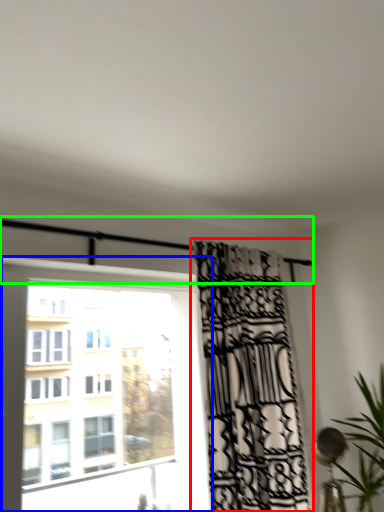
Question: Based on their relative distances, which object is farther from curtain (highlighted by a red box)? Choose from window (highlighted by a blue box) and balcony (highlighted by a green box).

Choices:
 (A) window
 (B) balcony

Answer: (A)